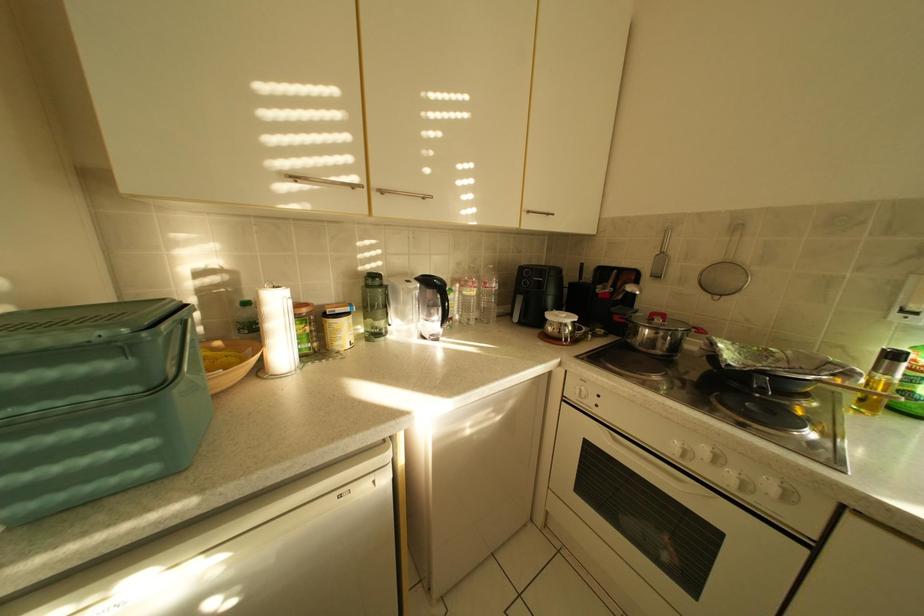
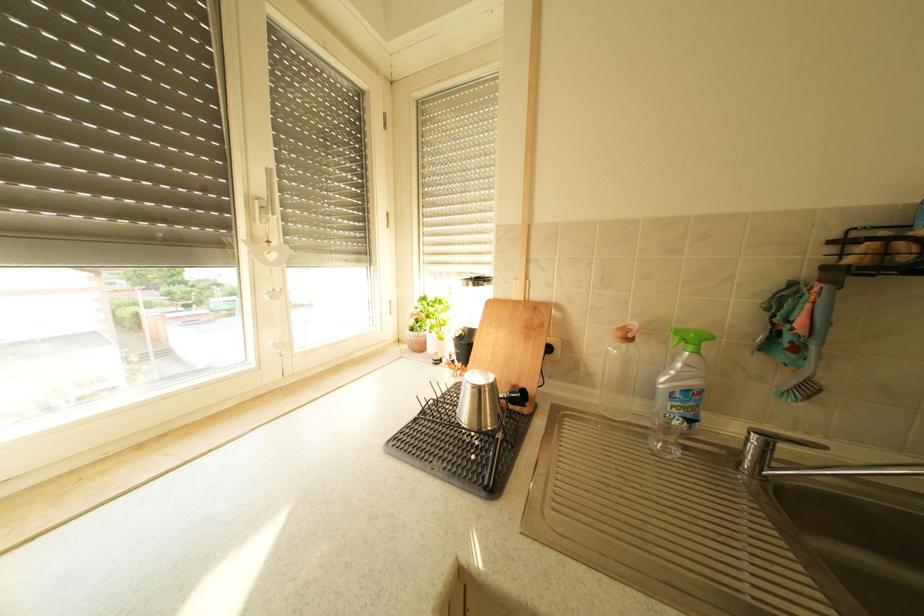
Based on the continuous images, in which direction is the camera rotating?

The camera rotated toward right-down.